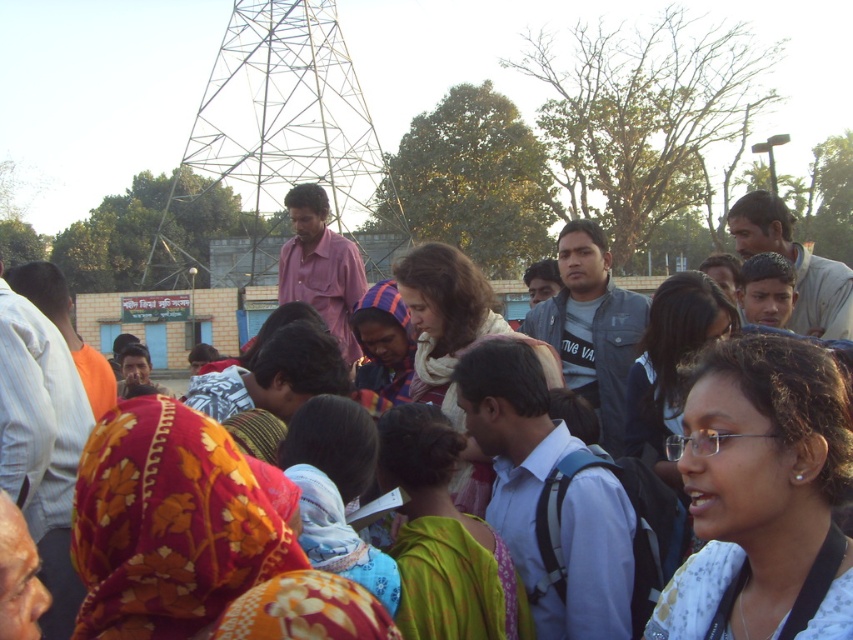
Question: Can you confirm if white fabric at center is bigger than multicolored fabric headscarf at center?

Choices:
 (A) no
 (B) yes

Answer: (B)

Question: Which point is closer to the camera?

Choices:
 (A) (381, 298)
 (B) (784, 520)
 (C) (677, 472)
 (D) (426, 621)

Answer: (B)

Question: Can you confirm if multicolored fabric at center is positioned below multicolored fabric headscarf at center?

Choices:
 (A) no
 (B) yes

Answer: (A)

Question: Which point is closer to the camera taking this photo?

Choices:
 (A) (386, 246)
 (B) (399, 380)
 (C) (726, 422)
 (D) (178, 557)

Answer: (D)

Question: Which point appears farthest from the camera in this image?

Choices:
 (A) (463, 556)
 (B) (335, 184)

Answer: (B)

Question: Does green floral sari at center have a greater width compared to multicolored fabric at center?

Choices:
 (A) no
 (B) yes

Answer: (A)